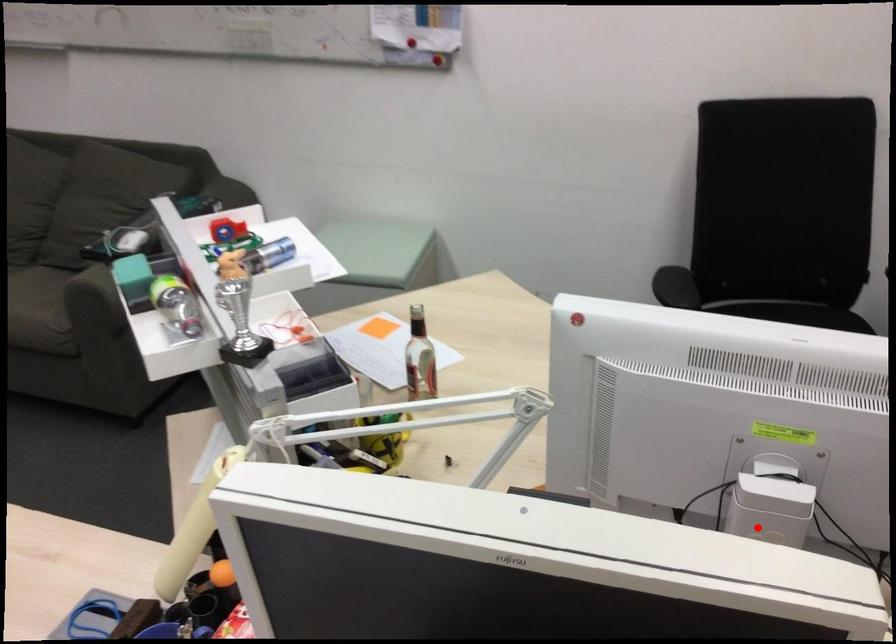
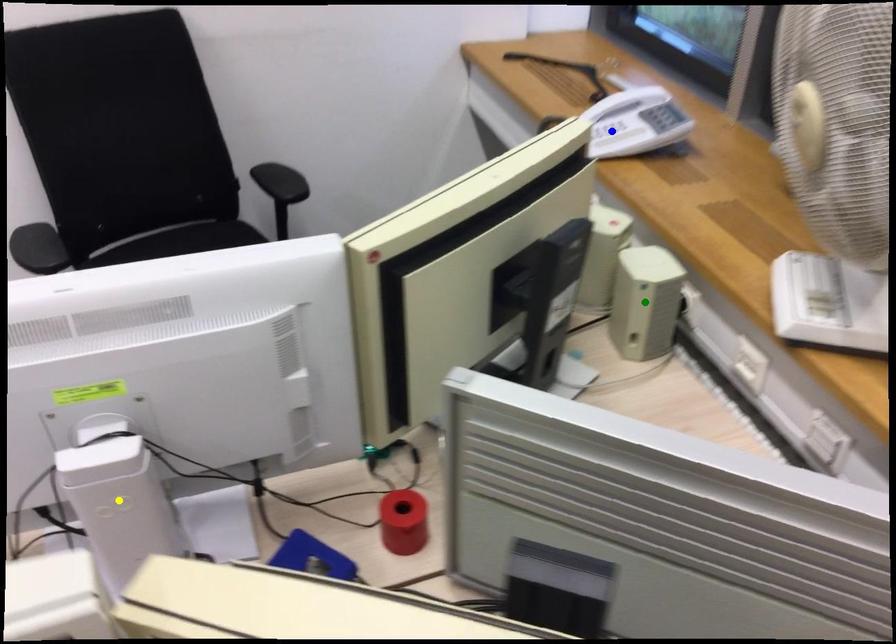
Question: I am providing you with two images of the same scene from different viewpoints. A red point is marked on the first image. You are given multiple points on the second image. Can you choose the point in image 2 that corresponds to the point in image 1?

Choices:
 (A) yellow point
 (B) green point
 (C) blue point

Answer: (A)